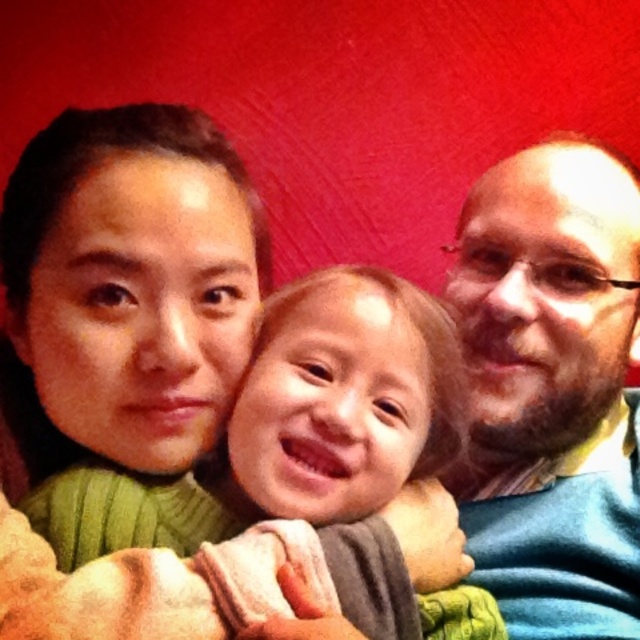
You are a photographer setting up a photo shoot with the scene described. You need to place a small prop between the blue sweater at right and the smooth beige blanket at center. Where should you place it to ensure it is between them spatially?

The blue sweater at right is above the smooth beige blanket at center, so placing the prop between them would require positioning it below the blue sweater at right and above the smooth beige blanket at center.

You are a photographer who needs to adjust the lighting to ensure both the blue sweater at right and the smooth beige blanket at center are evenly lit. Based on their positions, which object should you move closer to the light source?

The blue sweater at right is to the right of the smooth beige blanket at center. To ensure both are evenly lit, you should move the blue sweater at right closer to the light source since it is farther away from the blanket and might be in a darker area.

Please look at the image and identify which object the point at coordinates (552, 387) is located on. The scene includes a woman in a green sweater on the left, a child in the center, and a man in a blue sweater on the right. Your options are the woman in green sweater on the left, the child in the center, or the man in blue sweater on the right.

The point at coordinates (552, 387) is located on the blue sweater at right, which belongs to the man in blue sweater on the right.